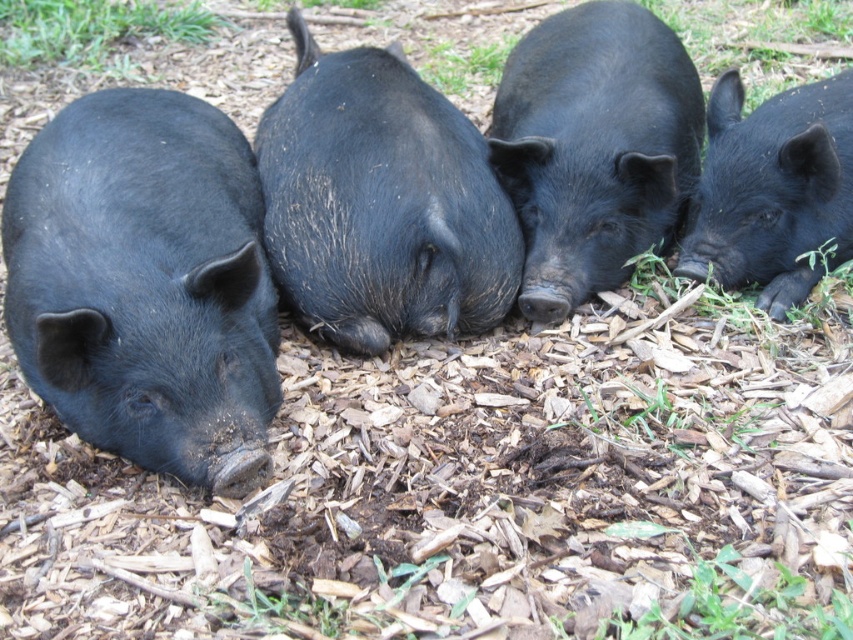
Question: Can you confirm if black matte pig at center is wider than green grass at upper left?

Choices:
 (A) no
 (B) yes

Answer: (A)

Question: Which point appears closest to the camera in this image?

Choices:
 (A) (173, 193)
 (B) (7, 8)
 (C) (527, 99)
 (D) (345, 198)

Answer: (A)

Question: Among these points, which one is nearest to the camera?

Choices:
 (A) (10, 45)
 (B) (164, 173)

Answer: (B)

Question: Which point is closer to the camera taking this photo?

Choices:
 (A) (744, 120)
 (B) (45, 44)

Answer: (A)

Question: Does matte black pig at left have a smaller size compared to black rough skin pig at center?

Choices:
 (A) yes
 (B) no

Answer: (A)

Question: Does matte black pig at left appear over black matte pig at center?

Choices:
 (A) yes
 (B) no

Answer: (B)